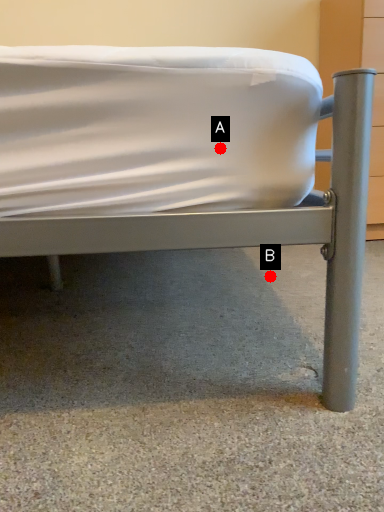
Question: Two points are circled on the image, labeled by A and B beside each circle. Which of the following is the closest to the observer?

Choices:
 (A) A is closer
 (B) B is closer

Answer: (A)